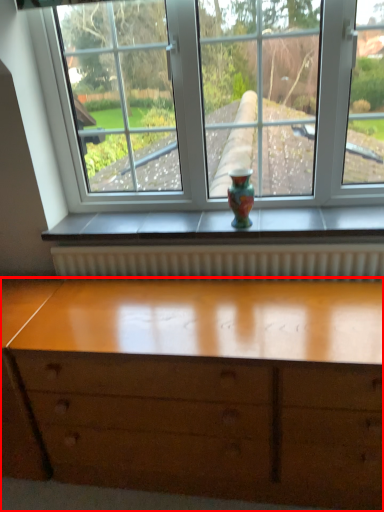
Question: In this image, where is chest of drawers (annotated by the red box) located relative to glass vase?

Choices:
 (A) right
 (B) left

Answer: (B)